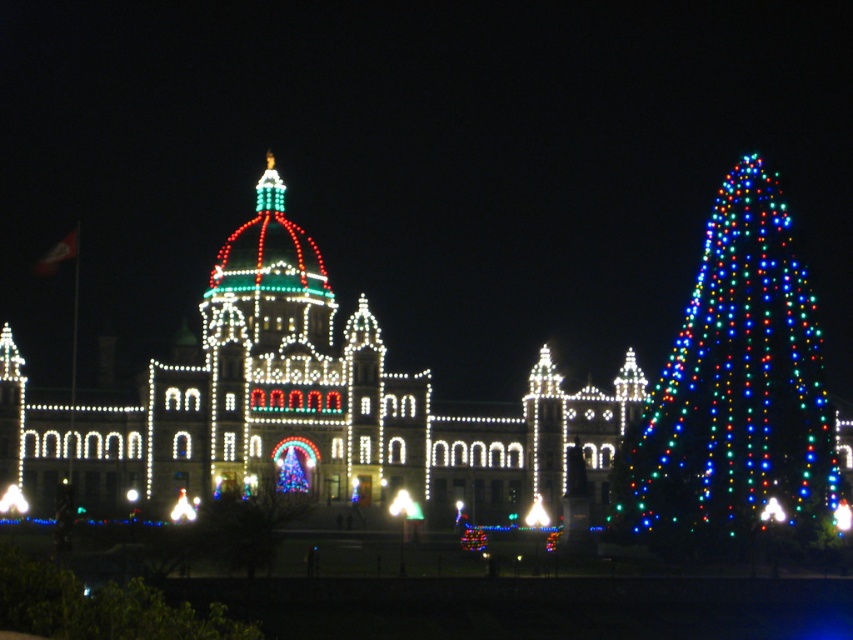
Question: Is illuminated stone building at center behind multicolored lights christmas tree at right?

Choices:
 (A) no
 (B) yes

Answer: (B)

Question: Considering the real-world distances, which object is closest to the illuminated plastic tree at center?

Choices:
 (A) multicolored lights christmas tree at right
 (B) illuminated stone building at center

Answer: (B)

Question: Which object is farther from the camera taking this photo?

Choices:
 (A) illuminated plastic tree at center
 (B) multicolored lights christmas tree at right
 (C) illuminated stone building at center

Answer: (C)

Question: Is illuminated stone building at center to the right of illuminated plastic tree at center from the viewer's perspective?

Choices:
 (A) no
 (B) yes

Answer: (A)

Question: Is illuminated stone building at center below illuminated plastic tree at center?

Choices:
 (A) yes
 (B) no

Answer: (B)

Question: Which point appears closest to the camera in this image?

Choices:
 (A) (341, 355)
 (B) (766, 332)

Answer: (B)